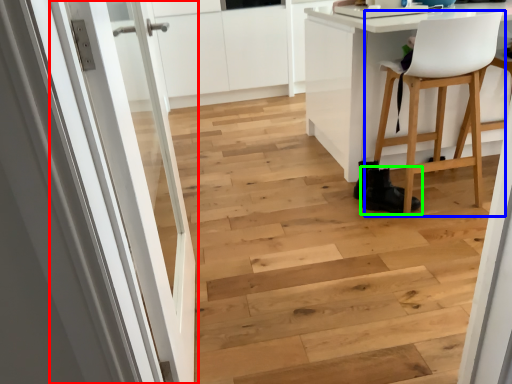
Question: Which is nearer to the door (highlighted by a red box)? chair (highlighted by a blue box) or footwear (highlighted by a green box).

Choices:
 (A) chair
 (B) footwear

Answer: (B)